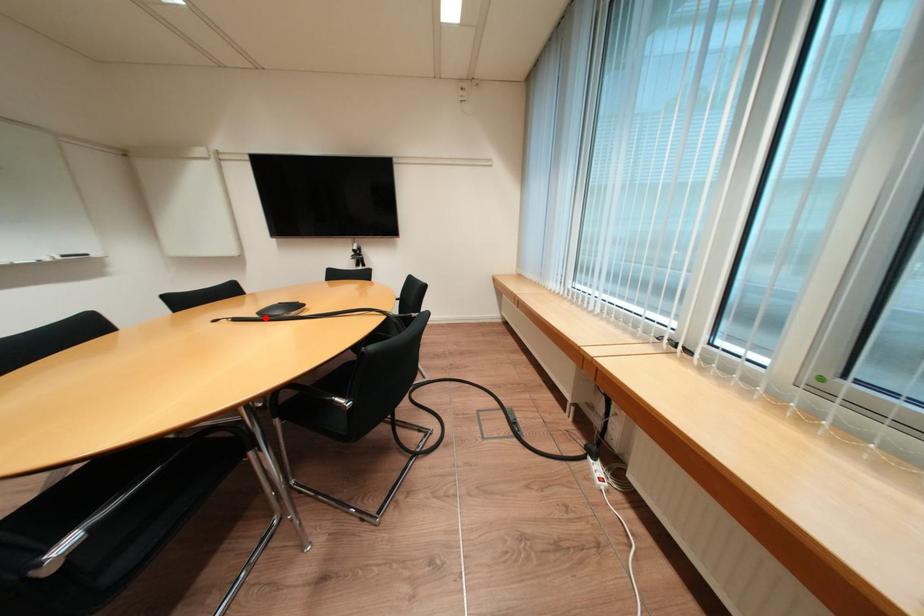
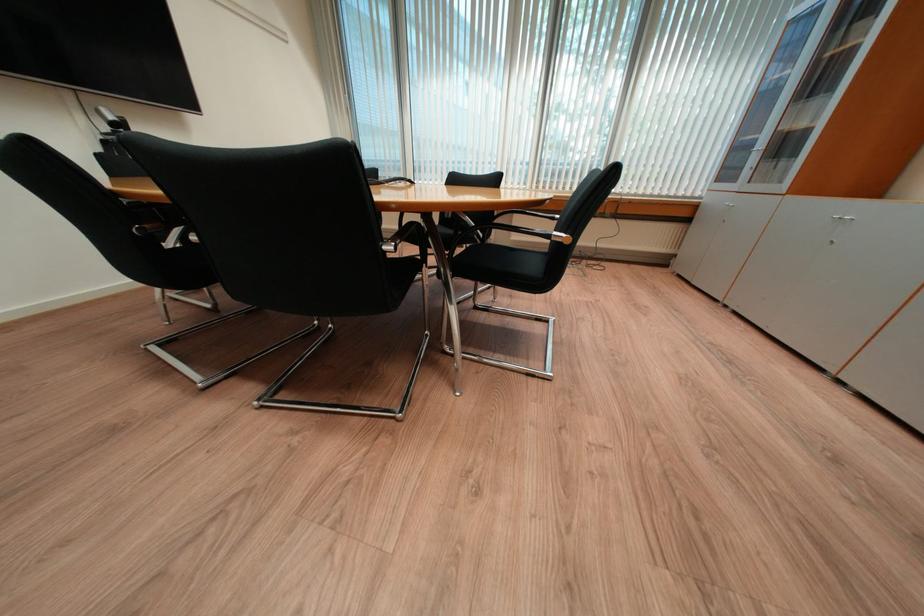
Question: I am providing you with two images of the same scene from different viewpoints. A red point is marked on the first image. Is the red point's position out of view in image 2?

Choices:
 (A) Yes
 (B) No

Answer: (A)